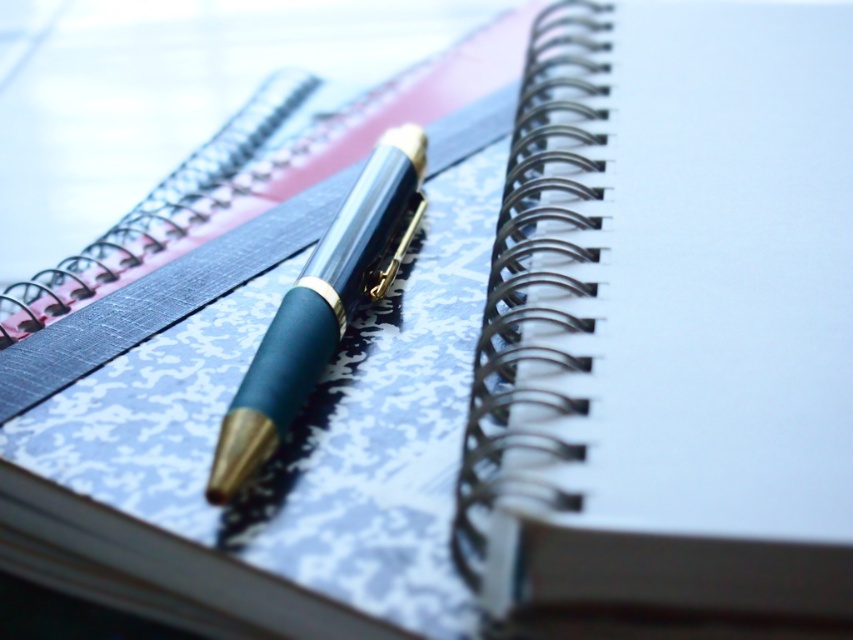
Between satin silver journal at upper left and matte blue pen at center, which one is positioned higher?

satin silver journal at upper left

Does satin silver journal at upper left appear over matte blue pen at center?

Indeed, satin silver journal at upper left is positioned over matte blue pen at center.

Does point (579, 108) come in front of point (248, 372)?

No, (579, 108) is behind (248, 372).

The image size is (853, 640). I want to click on satin silver journal at upper left, so click(x=669, y=317).